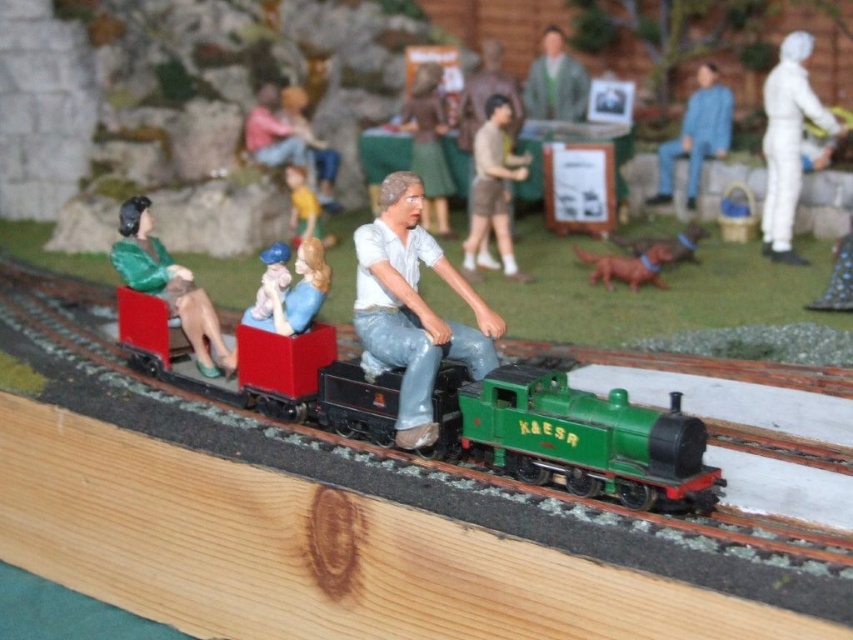
You are standing in front of the model train set and notice a pair of blue denim jeans at right. Where exactly are the blue denim jeans located in the scene?

The blue denim jeans at right are located at point (695,134) in the scene.

You are a photographer standing at the edge of the model train set. You want to take a photo of the matte white shirt at center. Where should you position your camera to capture it clearly?

The matte white shirt at center is located at point (412, 308), so you should position your camera directly facing that coordinate to capture it clearly.

In the model train scene, there are blue denim jeans at right and a smooth beige figurine at center. Which object is positioned more to the right?

The blue denim jeans at right are positioned more to the right than the smooth beige figurine at center.